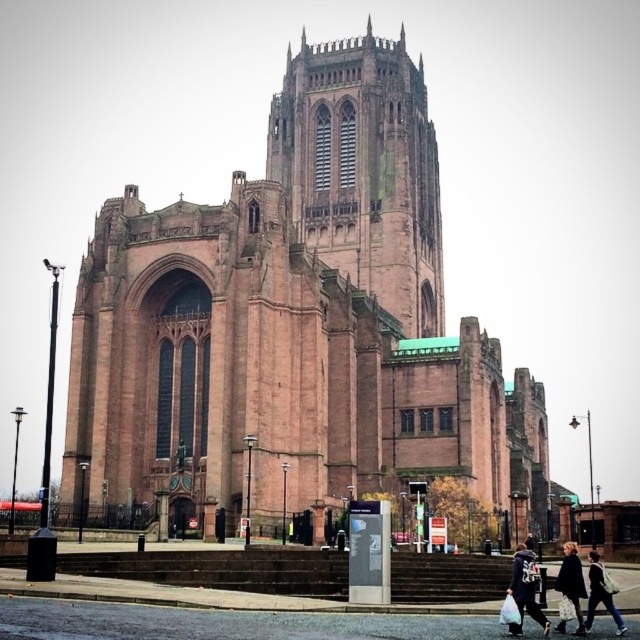
You are standing on the street in front of the cathedral and want to take a photo of the brown stone tower at center without any people blocking the view. Should you move towards the denim jacket at lower right or away from it?

The brown stone tower at center is positioned over denim jacket at lower right, so moving away from the denim jacket at lower right would help avoid people blocking the view.

You are a photographer standing at the base of the cathedral steps. You want to take a photo that includes both the fluffy black coat at lower right and the dark brown leather jacket at lower right. Which of the two items should you focus on to ensure both are in frame without moving your camera position?

The fluffy black coat at lower right is much taller than the dark brown leather jacket at lower right. Since the fluffy black coat is taller, focusing on it would ensure both are in frame as the jacket will naturally be within the same vertical plane.

You are a tourist standing at the base of the brown stone tower at center and want to take a photo of the denim jacket at lower right. Which object should you focus on first to ensure both are in the frame?

The brown stone tower at center is much taller than the denim jacket at lower right, so you should focus on the brown stone tower at center first to ensure both are in the frame.